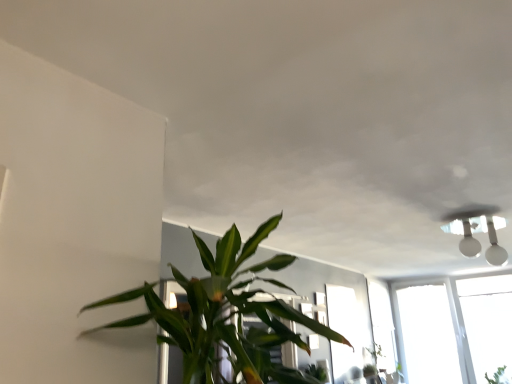
Question: Looking at their shapes, would you say green leafy plant at lower right is wider or thinner than green leafy plant at center?

Choices:
 (A) thin
 (B) wide

Answer: (A)

Question: Is green leafy plant at lower right to the left or to the right of green leafy plant at center in the image?

Choices:
 (A) left
 (B) right

Answer: (B)

Question: Estimate the real-world distances between objects in this image. Which object is closer to the transparent glass window at center?

Choices:
 (A) green leafy plant at lower right
 (B) green leafy plant at center

Answer: (A)

Question: Estimate the real-world distances between objects in this image. Which object is closer to the transparent glass window at center?

Choices:
 (A) green leafy plant at lower right
 (B) green leafy plant at center

Answer: (A)